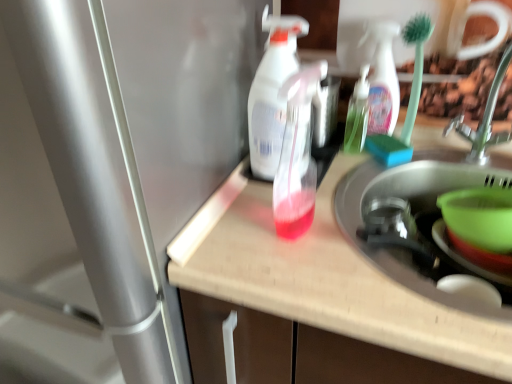
The image size is (512, 384). I want to click on free space that is to the left of green plastic brush at upper right, so click(342, 167).